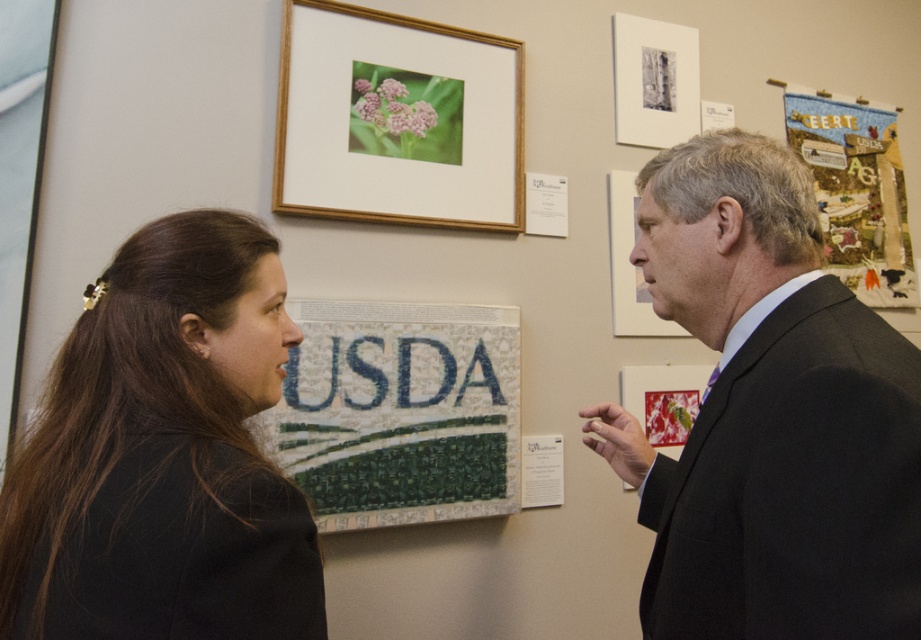
Question: Estimate the real-world distances between objects in this image. Which object is farther from the black fabric hair clip at left?

Choices:
 (A) matte wood picture frame at upper right
 (B) textured fabric poster at upper right

Answer: (B)

Question: Which of the following is the farthest from the observer?

Choices:
 (A) matte wood picture frame at upper right
 (B) black fabric hair clip at left

Answer: (A)

Question: Is mosaic tile usda sign at center closer to camera compared to textured fabric poster at upper right?

Choices:
 (A) yes
 (B) no

Answer: (A)

Question: Is mosaic tile usda sign at center further to the viewer compared to matte wood picture frame at upper right?

Choices:
 (A) no
 (B) yes

Answer: (A)

Question: Which point is closer to the camera?

Choices:
 (A) wooden frame at upper center
 (B) textured fabric poster at upper right

Answer: (A)

Question: Is the position of mosaic tile usda sign at center more distant than that of wooden frame at upper center?

Choices:
 (A) yes
 (B) no

Answer: (B)